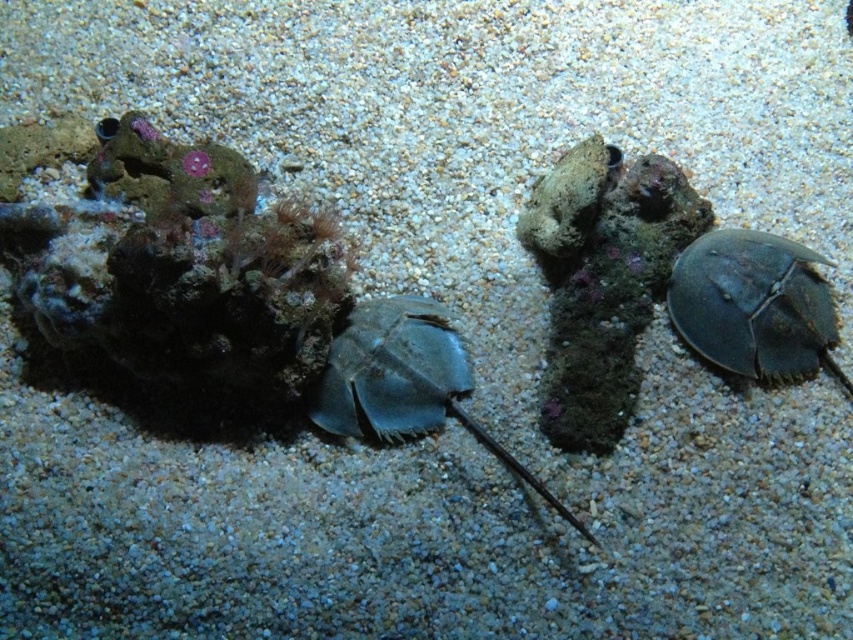
Is satin blue horseshoe crab at center to the left of smooth stone at center from the viewer's perspective?

Indeed, satin blue horseshoe crab at center is positioned on the left side of smooth stone at center.

This screenshot has width=853, height=640. I want to click on satin blue horseshoe crab at center, so click(x=403, y=380).

Which is more to the left, smooth gray horseshoe crab at right or satin blue horseshoe crab at center?

satin blue horseshoe crab at center

Is smooth gray horseshoe crab at right above satin blue horseshoe crab at center?

Correct, smooth gray horseshoe crab at right is located above satin blue horseshoe crab at center.

Where is `smooth gray horseshoe crab at right`? smooth gray horseshoe crab at right is located at coordinates (753, 305).

Which is in front, point (791, 362) or point (527, 221)?

Point (791, 362) is more forward.

Can you confirm if smooth gray horseshoe crab at right is bigger than smooth stone at center?

Correct, smooth gray horseshoe crab at right is larger in size than smooth stone at center.

I want to click on smooth gray horseshoe crab at right, so click(x=753, y=305).